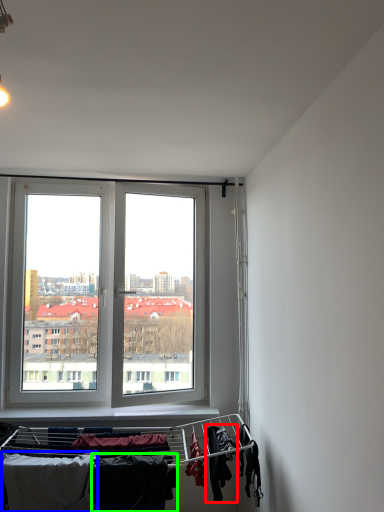
Question: Based on their relative distances, which object is farther from clothing (highlighted by a red box)? Choose from clothing (highlighted by a blue box) and clothing (highlighted by a green box).

Choices:
 (A) clothing
 (B) clothing

Answer: (A)